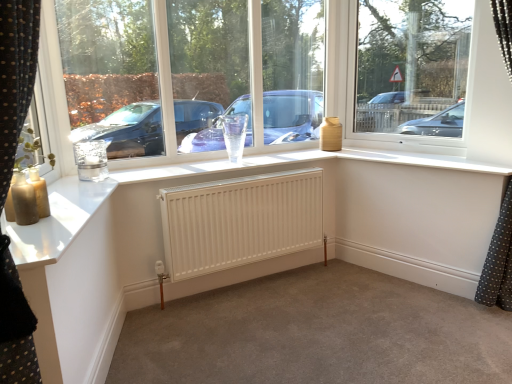
This screenshot has height=384, width=512. What are the coordinates of `vacant space underneath white matte radiator at center (from a real-world perspective)` in the screenshot? It's located at (252, 287).